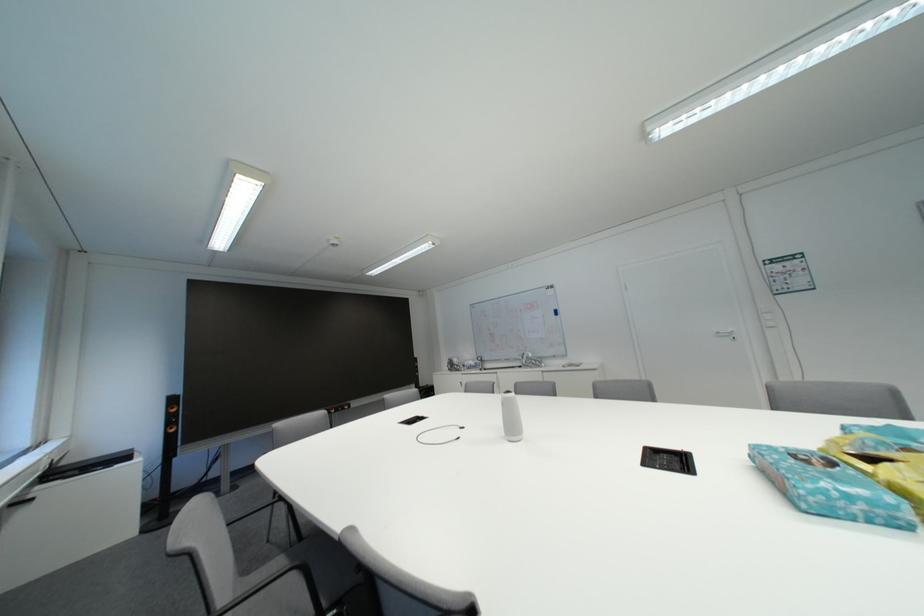
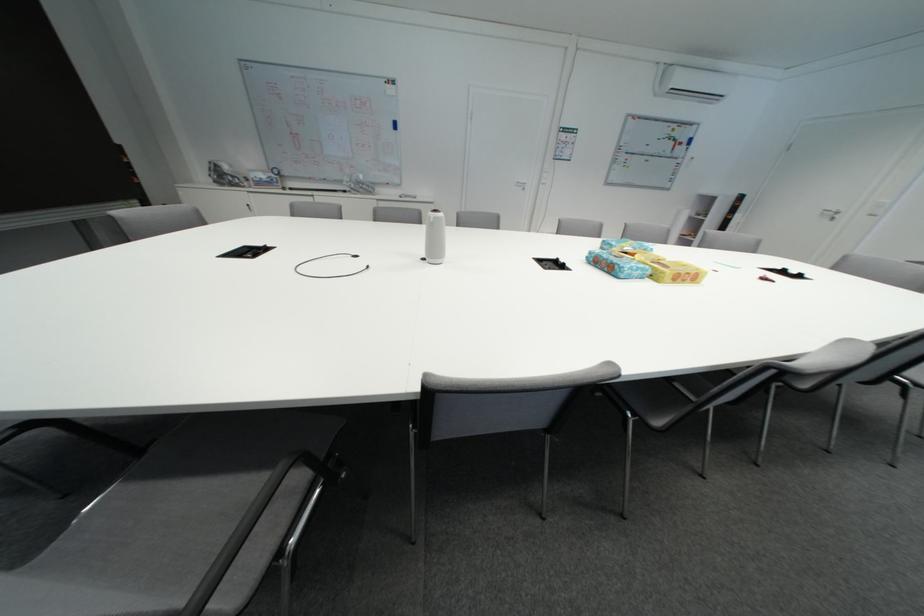
In the second image, find the point that corresponds to the point at 523,432 in the first image.

(444, 254)